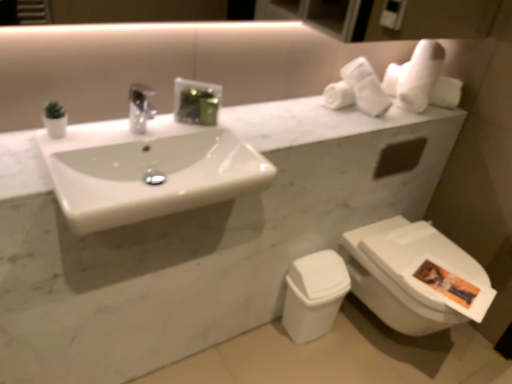
The width and height of the screenshot is (512, 384). Describe the element at coordinates (393, 83) in the screenshot. I see `white soft towel at upper right` at that location.

The width and height of the screenshot is (512, 384). Describe the element at coordinates (413, 276) in the screenshot. I see `white glossy toilet at lower right` at that location.

Image resolution: width=512 pixels, height=384 pixels. Find the location of `white plastic toilet bowl at lower right`. white plastic toilet bowl at lower right is located at coordinates (314, 294).

Where is `white glossy sink at center`? Image resolution: width=512 pixels, height=384 pixels. white glossy sink at center is located at coordinates tap(147, 170).

At what (x,y) coordinates should I click in order to perform the action: click on white soft towel at upper right. Please return your answer as a coordinate pair (x, y). This screenshot has height=384, width=512. Looking at the image, I should click on (393, 83).

In the image, is white glossy sink at center on the left side or the right side of white soft towel at upper right?

Clearly, white glossy sink at center is on the left of white soft towel at upper right in the image.

Which is in front, point (155, 127) or point (408, 88)?

Positioned in front is point (155, 127).

Between white glossy sink at center and white soft towel at upper right, which one has smaller width?

white soft towel at upper right is thinner.

Can you confirm if white glossy sink at center is bigger than white soft towel at upper right?

Indeed, white glossy sink at center has a larger size compared to white soft towel at upper right.

From a real-world perspective, is white glossy sink at center over white plastic toilet bowl at lower right?

Yes, from a real-world perspective, white glossy sink at center is on top of white plastic toilet bowl at lower right.

Based on the photo, does white glossy sink at center turn towards white plastic toilet bowl at lower right?

No, white glossy sink at center is not turned towards white plastic toilet bowl at lower right.

How far apart are white glossy sink at center and white plastic toilet bowl at lower right?

white glossy sink at center is 28.80 inches away from white plastic toilet bowl at lower right.

Is point (397, 89) behind point (321, 327)?

That is False.

From the image's perspective, between white soft towel at upper right and white plastic toilet bowl at lower right, who is located below?

white plastic toilet bowl at lower right is shown below in the image.

How different are the orientations of white soft towel at upper right and white plastic toilet bowl at lower right in degrees?

The facing directions of white soft towel at upper right and white plastic toilet bowl at lower right are 0.181 degrees apart.

From a real-world perspective, which is physically below, white soft towel at upper right or white plastic toilet bowl at lower right?

white plastic toilet bowl at lower right, from a real-world perspective.

From a real-world perspective, is white plastic toilet bowl at lower right beneath white glossy sink at center?

Correct, in the physical world, white plastic toilet bowl at lower right is lower than white glossy sink at center.

Relative to white glossy sink at center, is white plastic toilet bowl at lower right in front or behind?

In the image, white plastic toilet bowl at lower right appears behind white glossy sink at center.

How different are the orientations of white plastic toilet bowl at lower right and white glossy sink at center in degrees?

0.181 degrees separate the facing orientations of white plastic toilet bowl at lower right and white glossy sink at center.

Based on the photo, does white soft towel at upper right have a lesser width compared to white glossy sink at center?

Yes, white soft towel at upper right is thinner than white glossy sink at center.

Does white soft towel at upper right lie behind white glossy sink at center?

Yes, it is behind white glossy sink at center.

Is white soft towel at upper right smaller than white glossy sink at center?

Yes.

Is white glossy sink at center a part of white soft towel at upper right?

No, white glossy sink at center is not a part of white soft towel at upper right.

Does white plastic toilet bowl at lower right have a greater height compared to white soft towel at upper right?

Correct, white plastic toilet bowl at lower right is much taller as white soft towel at upper right.

From a real-world perspective, between white plastic toilet bowl at lower right and white soft towel at upper right, who is vertically lower?

white plastic toilet bowl at lower right, from a real-world perspective.

Between white plastic toilet bowl at lower right and white soft towel at upper right, which one has larger width?

white soft towel at upper right.

From the image's perspective, would you say white plastic toilet bowl at lower right is shown under white soft towel at upper right?

Yes.

How different are the orientations of white soft towel at upper right and white glossy toilet at lower right in degrees?

white soft towel at upper right and white glossy toilet at lower right are facing 0.0139 degrees away from each other.

You are a GUI agent. You are given a task and a screenshot of the screen. Output one action in this format:
    pyautogui.click(x=<x>, y=<y>)
    Task: Click on the toilet in front of the white soft towel at upper right
    
    Given the screenshot: What is the action you would take?
    pyautogui.click(x=413, y=276)

Is white soft towel at upper right closer to the viewer compared to white glossy toilet at lower right?

No, it is behind white glossy toilet at lower right.

Which object is positioned more to the right, white soft towel at upper right or white glossy toilet at lower right?

Positioned to the right is white soft towel at upper right.

The height and width of the screenshot is (384, 512). Find the location of `sink on the left of the white soft towel at upper right`. sink on the left of the white soft towel at upper right is located at coordinates (147, 170).

Identify the location of toilet bowl behind the white glossy sink at center. (314, 294).

From the picture: Based on their spatial positions, is white plastic toilet bowl at lower right or white soft towel at upper right further from white glossy toilet at lower right?

The object further to white glossy toilet at lower right is white soft towel at upper right.

When comparing their distances from white soft towel at upper right, does white glossy sink at center or white glossy toilet at lower right seem closer?

The object closer to white soft towel at upper right is white glossy toilet at lower right.

Estimate the real-world distances between objects in this image. Which object is further from white soft towel at upper right, white glossy toilet at lower right or white plastic toilet bowl at lower right?

Based on the image, white plastic toilet bowl at lower right appears to be further to white soft towel at upper right.

Looking at the image, which one is located further to white soft towel at upper right, white plastic toilet bowl at lower right or white glossy toilet at lower right?

white plastic toilet bowl at lower right lies further to white soft towel at upper right than the other object.

Estimate the real-world distances between objects in this image. Which object is closer to white glossy sink at center, white glossy toilet at lower right or white soft towel at upper right?

Based on the image, white soft towel at upper right appears to be nearer to white glossy sink at center.

When comparing their distances from white plastic toilet bowl at lower right, does white soft towel at upper right or white glossy sink at center seem closer?

Among the two, white glossy sink at center is located nearer to white plastic toilet bowl at lower right.

Which object lies nearer to the anchor point white plastic toilet bowl at lower right, white glossy toilet at lower right or white soft towel at upper right?

white glossy toilet at lower right lies closer to white plastic toilet bowl at lower right than the other object.

Based on their spatial positions, is white soft towel at upper right or white glossy toilet at lower right further from white plastic toilet bowl at lower right?

white soft towel at upper right lies further to white plastic toilet bowl at lower right than the other object.

Where is `toilet bowl between white glossy sink at center and white soft towel at upper right in the horizontal direction`? This screenshot has width=512, height=384. toilet bowl between white glossy sink at center and white soft towel at upper right in the horizontal direction is located at coordinates (314, 294).

At what (x,y) coordinates should I click in order to perform the action: click on toilet bowl between white glossy sink at center and white glossy toilet at lower right. Please return your answer as a coordinate pair (x, y). The image size is (512, 384). Looking at the image, I should click on (314, 294).

Where is `toilet located between white glossy sink at center and white soft towel at upper right in the left-right direction`? toilet located between white glossy sink at center and white soft towel at upper right in the left-right direction is located at coordinates (413, 276).

What are the coordinates of `toilet between white soft towel at upper right and white plastic toilet bowl at lower right from top to bottom` in the screenshot? It's located at (413, 276).